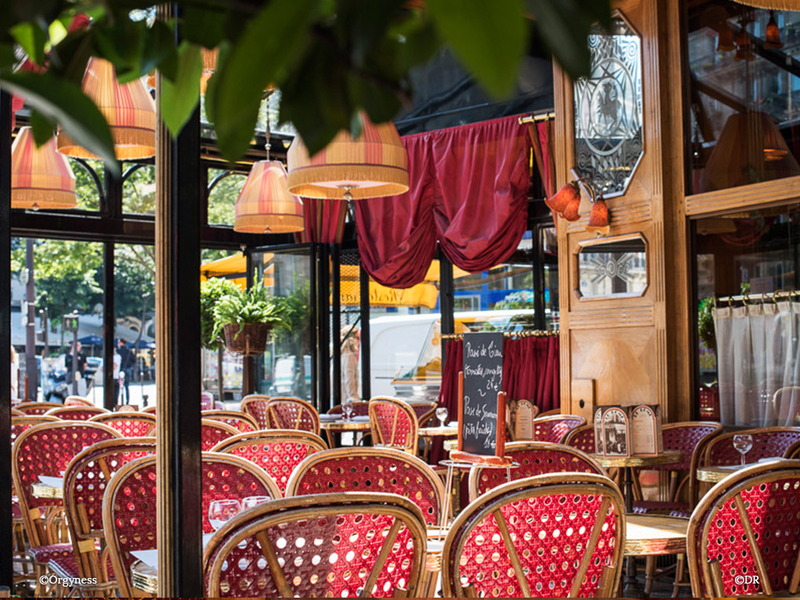
Find the location of a particular element. light is located at coordinates (348, 184), (125, 114), (46, 182), (566, 211), (558, 196), (593, 220).